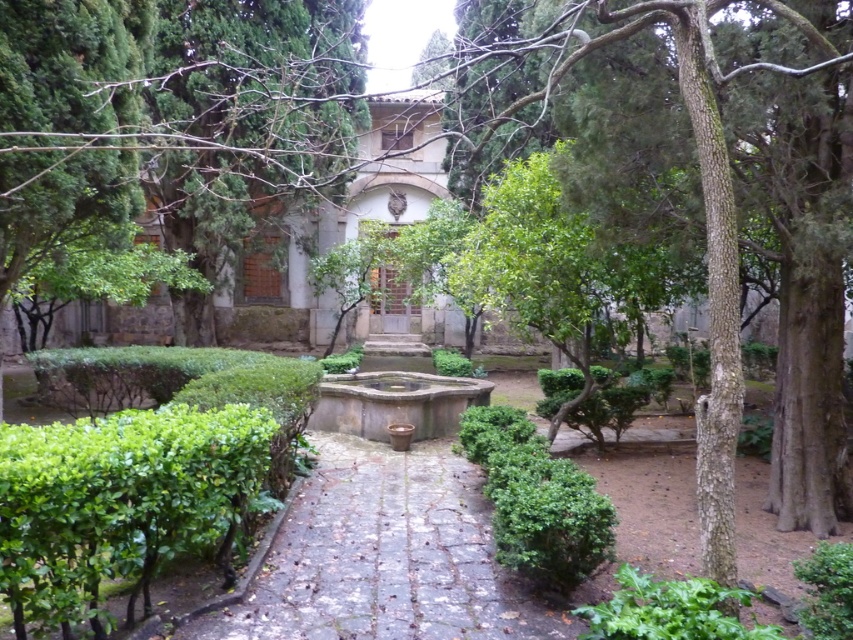
Does green leafy hedge at lower right appear on the left side of green leafy bush at lower right?

Yes, green leafy hedge at lower right is to the left of green leafy bush at lower right.

Can you confirm if green leafy hedge at lower right is positioned above green leafy bush at lower right?

Correct, green leafy hedge at lower right is located above green leafy bush at lower right.

Locate an element on the screen. green leafy hedge at lower right is located at coordinates (537, 500).

Between green stone path at center and green leafy bush at lower right, which one is positioned lower?

green stone path at center is lower down.

Is green stone path at center below green leafy bush at lower right?

Correct, green stone path at center is located below green leafy bush at lower right.

Is point (300, 513) positioned after point (740, 627)?

Yes.

This screenshot has height=640, width=853. In order to click on green stone path at center in this screenshot , I will do `click(384, 556)`.

Which is behind, point (795, 356) or point (633, 595)?

The point (795, 356) is more distant.

Does green rough bark tree at center have a lesser height compared to green leafy bush at lower right?

No.

In order to click on green rough bark tree at center in this screenshot , I will do 694,218.